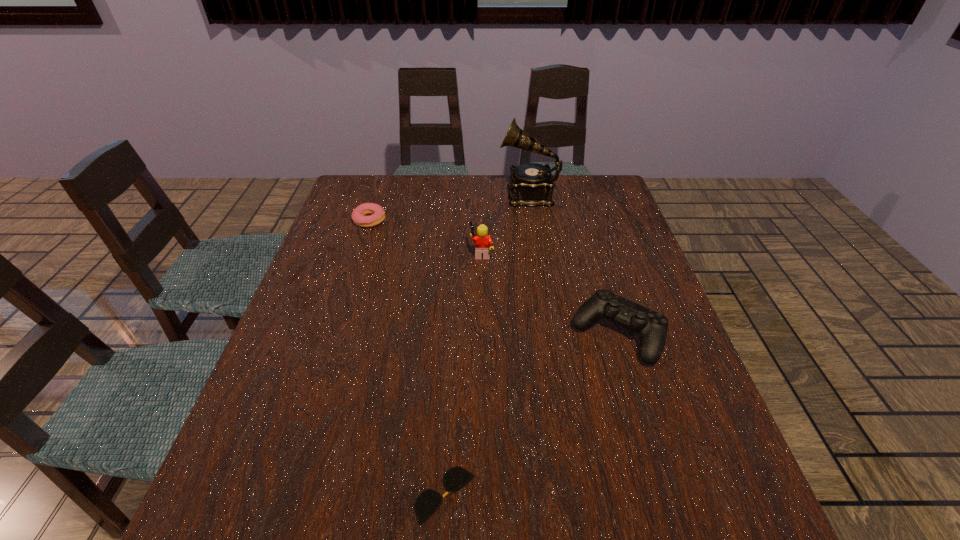
Identify the location of vacant area that lies between the phonograph record and the fourth farthest object. (573, 264).

This screenshot has width=960, height=540. In order to click on unoccupied area between the spectacles and the phonograph record in this screenshot , I will do `click(487, 345)`.

Locate an element on the screen. This screenshot has height=540, width=960. unoccupied area between the fourth farthest object and the Lego is located at coordinates (549, 293).

Where is `empty location between the second shortest object and the nearest object`? empty location between the second shortest object and the nearest object is located at coordinates (407, 358).

Find the location of a particular element. The height and width of the screenshot is (540, 960). vacant region between the second shortest object and the control is located at coordinates (493, 277).

Locate an element on the screen. vacant region between the second tallest object and the nearest object is located at coordinates (464, 374).

Where is `vacant region between the phonograph record and the fourth nearest object`? vacant region between the phonograph record and the fourth nearest object is located at coordinates (449, 207).

Identify the location of blank region between the third farthest object and the fourth nearest object. (425, 237).

This screenshot has height=540, width=960. I want to click on free space between the tallest object and the third nearest object, so click(505, 224).

This screenshot has width=960, height=540. Identify the location of object that is the closest one to the fourth farthest object. (483, 242).